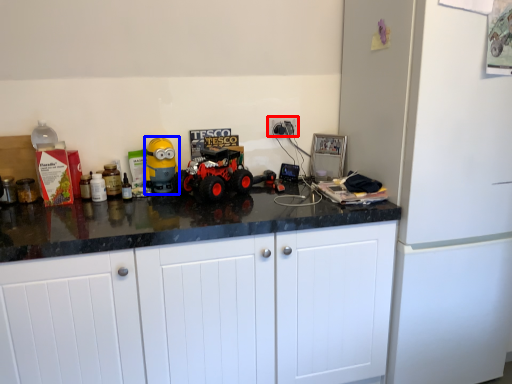
Question: Which object appears farthest to the camera in this image, electric outlet (highlighted by a red box) or toy (highlighted by a blue box)?

Choices:
 (A) electric outlet
 (B) toy

Answer: (A)